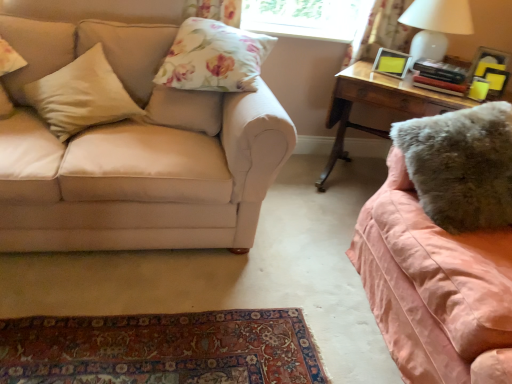
Question: Looking at their shapes, would you say floral fabric pillow at upper center, the third pillow when ordered from left to right, is wider or thinner than wooden desk at right?

Choices:
 (A) wide
 (B) thin

Answer: (B)

Question: Considering the positions of point (190, 41) and point (359, 97), is point (190, 41) closer or farther from the camera than point (359, 97)?

Choices:
 (A) farther
 (B) closer

Answer: (B)

Question: Which object is positioned closest to the floral fabric curtain at upper right?

Choices:
 (A) white glossy table lamp at upper right
 (B) wooden desk at right
 (C) floral fabric pillow at upper center, which is counted as the second pillow, starting from the right
 (D) beige fabric pillow at left, which appears as the 2th pillow when viewed from the left
 (E) beige fabric pillow at left, marked as the fourth pillow in a right-to-left arrangement

Answer: (A)

Question: Considering the real-world distances, which object is farthest from the floral fabric pillow at upper center, the third pillow when ordered from left to right?

Choices:
 (A) wooden desk at right
 (B) beige fabric couch at left, the 2th studio couch when ordered from right to left
 (C) floral fabric curtain at upper right
 (D) fuzzy pink blanket at right, which is the first studio couch from right to left
 (E) matte yellow picture frame at upper right

Answer: (C)